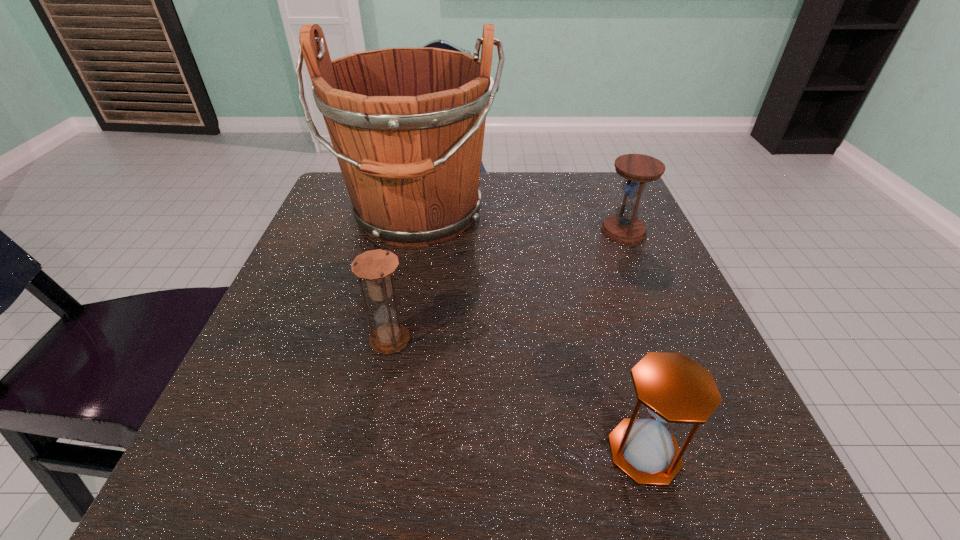
The image size is (960, 540). What are the coordinates of `vacant region located on the back of the second hourglass from right to left` in the screenshot? It's located at (626, 390).

I want to click on bucket situated at the far edge, so click(x=407, y=125).

Image resolution: width=960 pixels, height=540 pixels. Find the location of `hourglass present at the far edge`. hourglass present at the far edge is located at coordinates (624, 227).

Identify the location of object present at the near edge. (675, 389).

Find the location of a particular element. This screenshot has height=540, width=960. object that is at the left edge is located at coordinates (407, 125).

Locate an element on the screen. object at the far left corner is located at coordinates (407, 125).

I want to click on object located at the far right corner, so click(624, 227).

Find the location of `object at the near right corner`. object at the near right corner is located at coordinates (675, 389).

In the image, there is a desktop. Identify the location of free region at the far edge. This screenshot has height=540, width=960. (506, 176).

In the image, there is a desktop. Where is `vacant region at the near edge`? vacant region at the near edge is located at coordinates pyautogui.click(x=574, y=461).